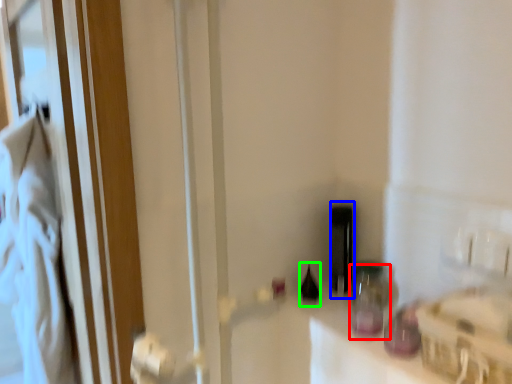
Question: Based on their relative distances, which object is nearer to bottle (highlighted by a red box)? Choose from bottle (highlighted by a blue box) and bottle (highlighted by a green box).

Choices:
 (A) bottle
 (B) bottle

Answer: (A)